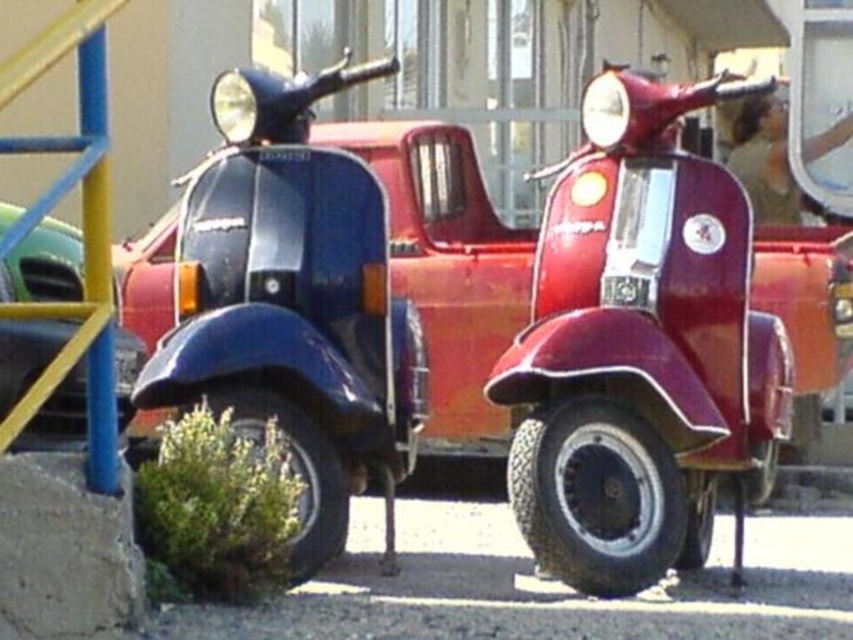
You are standing at the origin point in the image. Which direction should you move to reach the glossy blue scooter at center?

The glossy blue scooter at center is located at coordinates 0.423 on the x axis and 0.526 on the y axis. To reach it from the origin, you should move right along the x axis and up along the y axis.

From the picture: You are a photographer trying to capture both the shiny red pickup truck at center and the glossy blue scooter at center in a single shot. Which object will appear larger in the photo?

The shiny red pickup truck at center will appear larger in the photo because it is closer to the viewer than the glossy blue scooter at center.

Looking at this image, you are a delivery person trying to park your van between the shiny red pickup truck at center and the green matte car at left. Can you fit your van, which is 6 meters long, in the space between them?

The shiny red pickup truck at center is larger than the green matte car at left, but the description does not provide the exact distance between them. Without knowing the space between the two vehicles, it is impossible to determine if the van will fit.